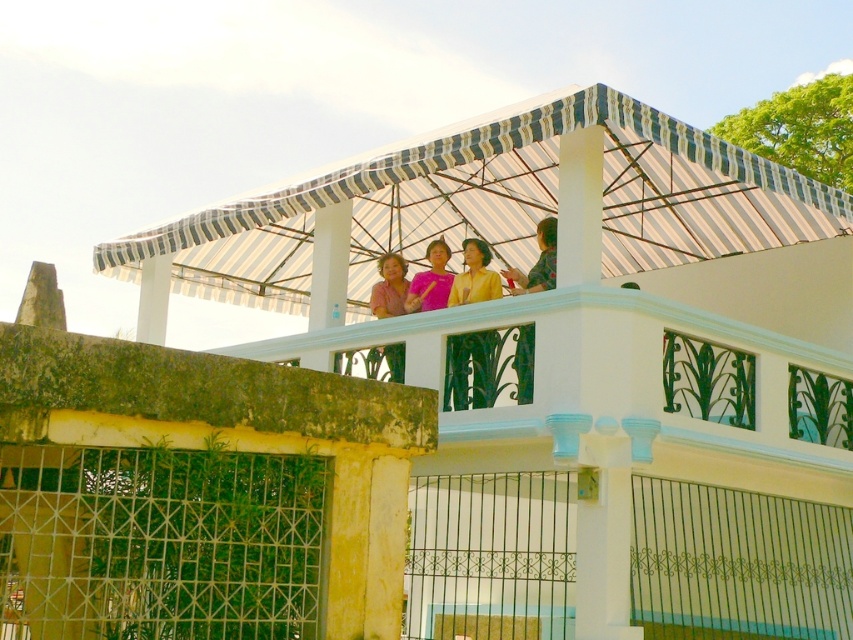
Is point (831, 372) behind point (468, 355)?

Yes, it is behind point (468, 355).

Is white painted concrete balcony at upper center bigger than yellow matte blouse at center?

No, white painted concrete balcony at upper center is not bigger than yellow matte blouse at center.

This screenshot has height=640, width=853. Describe the element at coordinates (608, 387) in the screenshot. I see `white painted concrete balcony at upper center` at that location.

In order to click on white painted concrete balcony at upper center in this screenshot , I will do `click(608, 387)`.

Can you confirm if white painted concrete balcony at upper center is taller than pink fabric at upper center?

Incorrect, white painted concrete balcony at upper center's height is not larger of pink fabric at upper center's.

The height and width of the screenshot is (640, 853). What do you see at coordinates (608, 387) in the screenshot?
I see `white painted concrete balcony at upper center` at bounding box center [608, 387].

Is point (440, 448) more distant than point (401, 342)?

No, it is not.

The width and height of the screenshot is (853, 640). I want to click on white painted concrete balcony at upper center, so click(x=608, y=387).

Between white striped awning at center and pink fabric at upper center, which one is positioned lower?

pink fabric at upper center

Is the position of white striped awning at center more distant than that of pink fabric at upper center?

That is False.

Is point (677, 196) closer to viewer compared to point (395, 276)?

Yes.

Identify the location of white striped awning at center. The width and height of the screenshot is (853, 640). (495, 204).